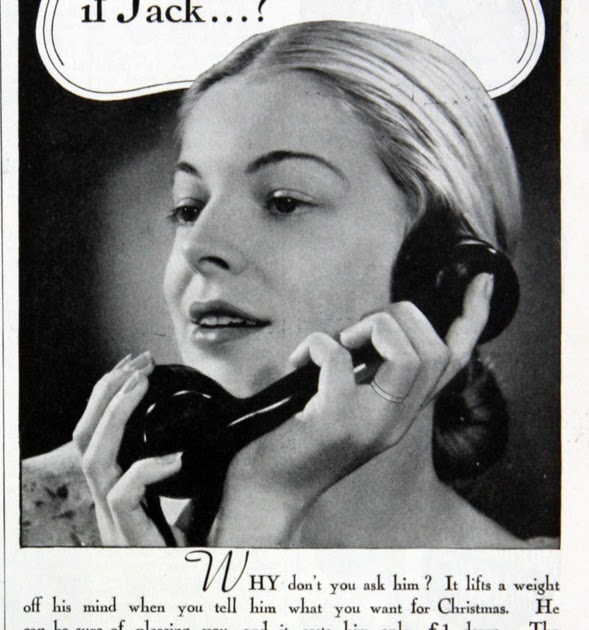
I want to click on old black telephone handset, so click(279, 401).